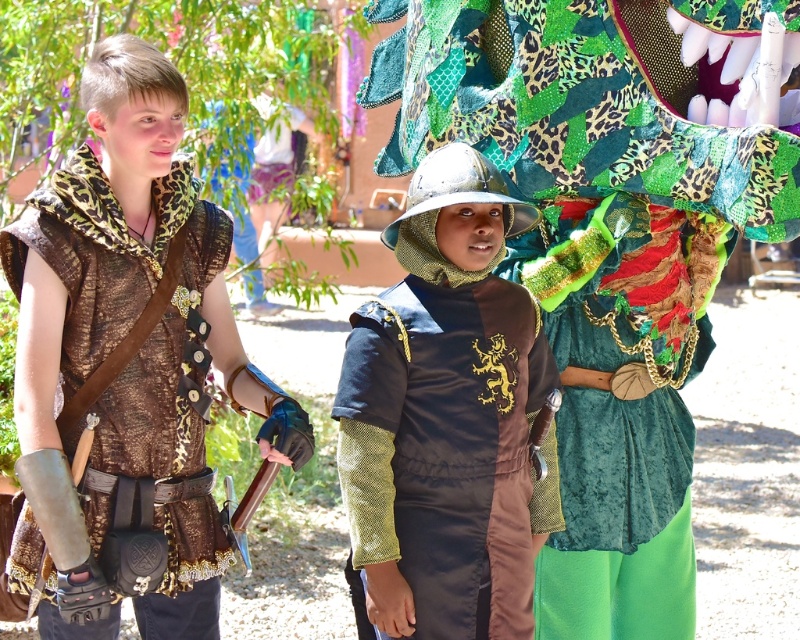
Question: Estimate the real-world distances between objects in this image. Which object is closer to the velvet green dragon head at center?

Choices:
 (A) metallic silver helmet at center
 (B) leopard print fabric vest at left

Answer: (A)

Question: Is velvet green dragon head at center bigger than metallic silver helmet at center?

Choices:
 (A) yes
 (B) no

Answer: (B)

Question: Can you confirm if velvet green dragon head at center is positioned to the right of leopard print fabric vest at left?

Choices:
 (A) yes
 (B) no

Answer: (A)

Question: Which of the following is the farthest from the observer?

Choices:
 (A) (444, 323)
 (B) (102, 221)
 (C) (790, 35)

Answer: (A)

Question: Is metallic silver helmet at center thinner than leopard print fabric vest at left?

Choices:
 (A) yes
 (B) no

Answer: (B)

Question: Which point is closer to the camera?

Choices:
 (A) (580, 394)
 (B) (512, 586)

Answer: (B)